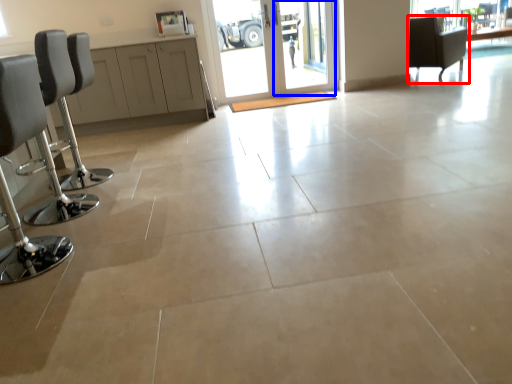
Question: Which object is further to the camera taking this photo, chair (highlighted by a red box) or screen door (highlighted by a blue box)?

Choices:
 (A) chair
 (B) screen door

Answer: (A)